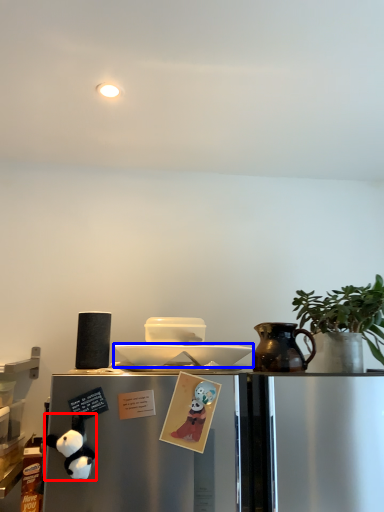
Question: Among these objects, which one is nearest to the camera, toy (highlighted by a red box) or plate (highlighted by a blue box)?

Choices:
 (A) toy
 (B) plate

Answer: (A)